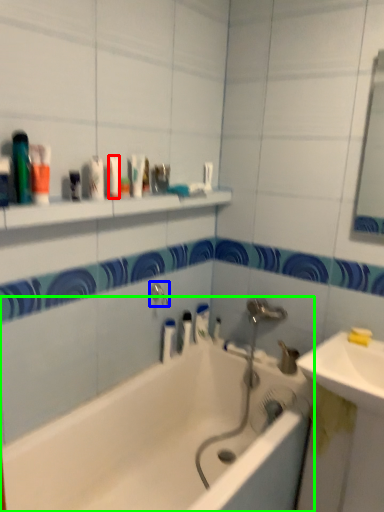
Question: Which is nearer to the mouthwash (highlighted by a red box)? tap (highlighted by a blue box) or bathtub (highlighted by a green box).

Choices:
 (A) tap
 (B) bathtub

Answer: (A)